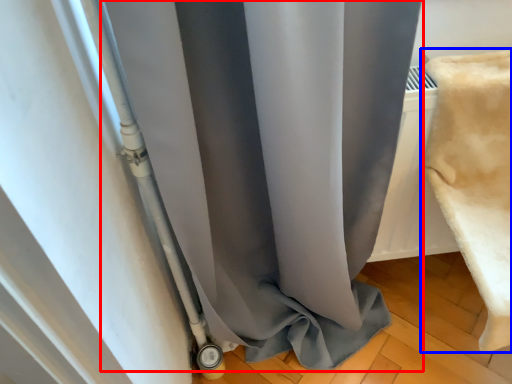
Question: Which of the following is the closest to the observer, curtain (highlighted by a red box) or material (highlighted by a blue box)?

Choices:
 (A) curtain
 (B) material

Answer: (A)